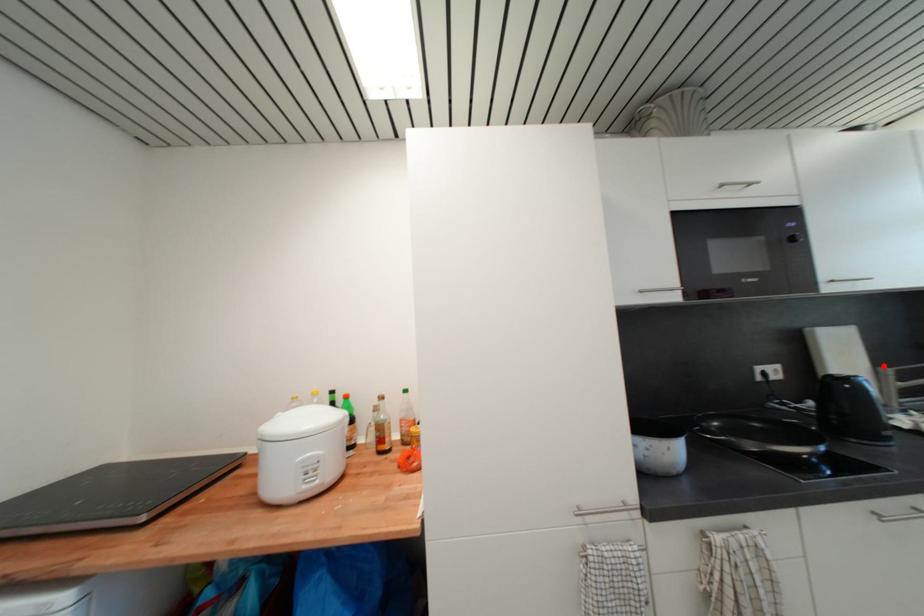
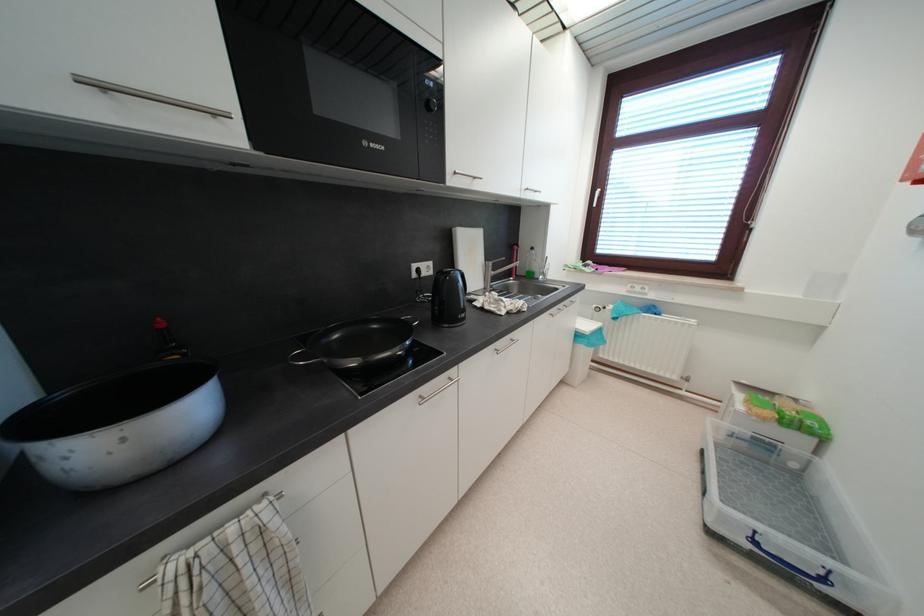
In the second image, find the point that corresponds to the highlighted location in the first image.

(492, 261)